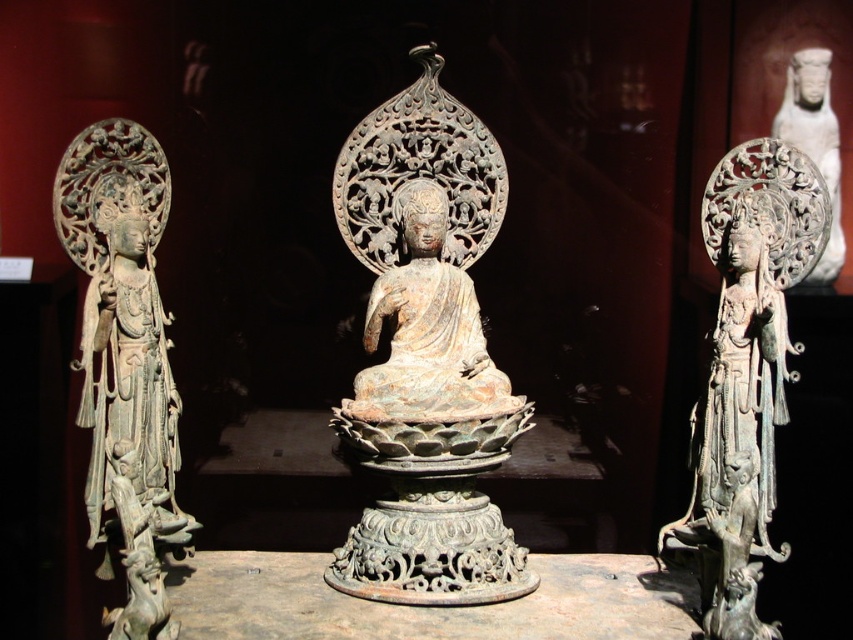
Does rusty bronze statue at center appear on the left side of green patina statue at left?

No, rusty bronze statue at center is not to the left of green patina statue at left.

Can you confirm if rusty bronze statue at center is bigger than green patina statue at left?

Correct, rusty bronze statue at center is larger in size than green patina statue at left.

Who is more forward, (479, 419) or (161, 397)?

Point (479, 419)

Where is `rusty bronze statue at center`? The image size is (853, 640). rusty bronze statue at center is located at coordinates (426, 355).

Does point (738, 204) come behind point (833, 212)?

No, (738, 204) is closer to viewer.

Is point (792, 200) in front of point (831, 232)?

Yes, it is.

Does point (782, 259) come closer to viewer compared to point (798, 77)?

Yes, it is in front of point (798, 77).

The height and width of the screenshot is (640, 853). Find the location of `bronze statue at center`. bronze statue at center is located at coordinates (746, 372).

Can you confirm if rusty bronze statue at center is bigger than white porcelain statue at upper right?

Yes.

Does rusty bronze statue at center have a greater width compared to white porcelain statue at upper right?

Yes, rusty bronze statue at center is wider than white porcelain statue at upper right.

Is point (425, 225) closer to camera compared to point (811, 138)?

Yes.

This screenshot has width=853, height=640. What are the coordinates of `rusty bronze statue at center` in the screenshot? It's located at (426, 355).